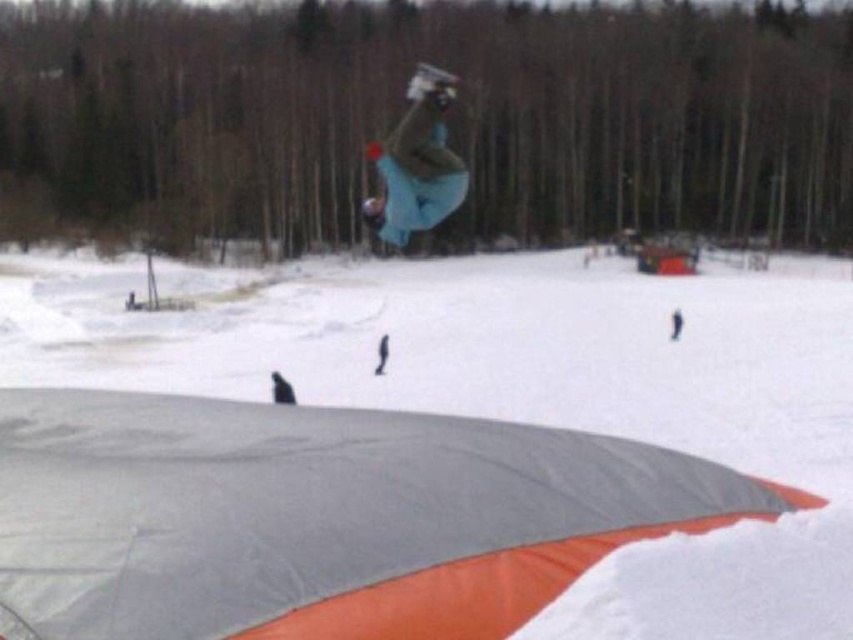
Can you confirm if white matte snow at center is positioned above blue fabric snowboarder at center?

Actually, white matte snow at center is below blue fabric snowboarder at center.

Can you confirm if white matte snow at center is thinner than blue fabric snowboarder at center?

Incorrect, white matte snow at center's width is not less than blue fabric snowboarder at center's.

Identify the location of white matte snow at center. (520, 390).

Locate an element on the screen. This screenshot has height=640, width=853. white matte snow at center is located at coordinates (520, 390).